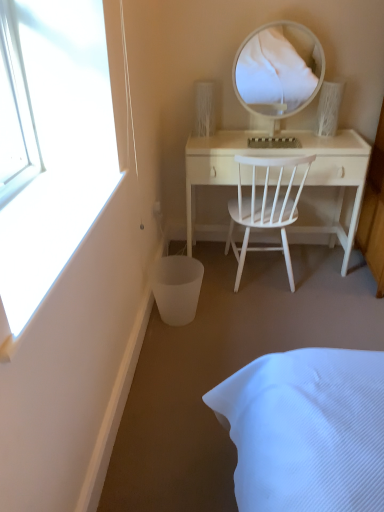
At what (x,y) coordinates should I click in order to perform the action: click on white glossy mirror at upper center. Please return your answer as a coordinate pair (x, y). This screenshot has width=384, height=512. Looking at the image, I should click on (277, 71).

You are a GUI agent. You are given a task and a screenshot of the screen. Output one action in this format:
    pyautogui.click(x=<x>, y=<y>)
    Task: Click on the white matte trash bin/can at lower left
    
    Given the screenshot: What is the action you would take?
    pyautogui.click(x=177, y=288)

Identify the location of white wood chair at center. This screenshot has width=384, height=512. (265, 209).

Locate an element on the screen. The image size is (384, 512). white wood desk at center is located at coordinates (280, 155).

Which of these two, white matte trash bin/can at lower left or white glossy mirror at upper center, is wider?

white matte trash bin/can at lower left.

Is white matte trash bin/can at lower left aimed at white glossy mirror at upper center?

No, white matte trash bin/can at lower left is not oriented towards white glossy mirror at upper center.

Considering the relative sizes of white matte trash bin/can at lower left and white glossy mirror at upper center in the image provided, is white matte trash bin/can at lower left shorter than white glossy mirror at upper center?

Correct, white matte trash bin/can at lower left is not as tall as white glossy mirror at upper center.

Do you think white matte trash bin/can at lower left is within white glossy mirror at upper center, or outside of it?

white matte trash bin/can at lower left is outside white glossy mirror at upper center.

Is white matte trash bin/can at lower left smaller than white wood chair at center?

Yes.

How many degrees apart are the facing directions of white matte trash bin/can at lower left and white wood chair at center?

The facing directions of white matte trash bin/can at lower left and white wood chair at center are 90 degrees apart.

Between point (161, 289) and point (242, 159), which one is positioned in front?

Positioned in front is point (161, 289).

From a real-world perspective, is white wood desk at center above or below white glossy mirror at upper center?

white wood desk at center is below white glossy mirror at upper center.

Measure the distance from white wood desk at center to white glossy mirror at upper center.

white wood desk at center and white glossy mirror at upper center are 1.63 meters apart.

Can you confirm if white wood desk at center is wider than white glossy mirror at upper center?

Yes, white wood desk at center is wider than white glossy mirror at upper center.

Considering the sizes of objects white wood desk at center and white glossy mirror at upper center in the image provided, who is bigger, white wood desk at center or white glossy mirror at upper center?

white wood desk at center is bigger.

Does white glossy mirror at upper center have a lesser width compared to white wood chair at center?

Yes.

Is point (286, 76) positioned after point (270, 164)?

Yes, point (286, 76) is farther from viewer.

Are white glossy mirror at upper center and white wood chair at center located far from each other?

white glossy mirror at upper center is positioned a significant distance from white wood chair at center.

Considering the sizes of white glossy mirror at upper center and white wood chair at center in the image, is white glossy mirror at upper center bigger or smaller than white wood chair at center?

In the image, white glossy mirror at upper center appears to be smaller than white wood chair at center.

Identify the location of mirror above the white wood chair at center (from the image's perspective). (277, 71).

Considering the relative sizes of white wood chair at center and white glossy mirror at upper center in the image provided, is white wood chair at center shorter than white glossy mirror at upper center?

Incorrect, the height of white wood chair at center does not fall short of that of white glossy mirror at upper center.

Is white wood chair at center not near white glossy mirror at upper center?

white wood chair at center is positioned a significant distance from white glossy mirror at upper center.

How many degrees apart are the facing directions of white wood chair at center and white glossy mirror at upper center?

The facing directions of white wood chair at center and white glossy mirror at upper center are 179 degrees apart.

From the image's perspective, is white wood chair at center on top of white matte trash bin/can at lower left?

Yes.

I want to click on chair above the white matte trash bin/can at lower left (from a real-world perspective), so [265, 209].

Are white wood chair at center and white matte trash bin/can at lower left far apart?

That's not correct — white wood chair at center is a little close to white matte trash bin/can at lower left.

Consider the image. Could you tell me if white wood desk at center is turned towards white matte trash bin/can at lower left?

Yes, white wood desk at center is aimed at white matte trash bin/can at lower left.

From their relative heights in the image, would you say white wood desk at center is taller or shorter than white matte trash bin/can at lower left?

In the image, white wood desk at center appears to be taller than white matte trash bin/can at lower left.

This screenshot has height=512, width=384. What are the coordinates of `mirror located on the right of white matte trash bin/can at lower left` in the screenshot? It's located at (277, 71).

This screenshot has width=384, height=512. Identify the location of chair that appears above the white matte trash bin/can at lower left (from the image's perspective). (265, 209).

From the image, which object appears to be farther from white matte trash bin/can at lower left, white glossy mirror at upper center or white wood chair at center?

white glossy mirror at upper center is positioned further to the anchor white matte trash bin/can at lower left.

Looking at the image, which one is located closer to white glossy mirror at upper center, white wood desk at center or white wood chair at center?

The object closer to white glossy mirror at upper center is white wood desk at center.

Based on their spatial positions, is white matte trash bin/can at lower left or white glossy mirror at upper center further from white wood desk at center?

white glossy mirror at upper center is positioned further to the anchor white wood desk at center.

When comparing their distances from white glossy mirror at upper center, does white wood chair at center or white wood desk at center seem further?

white wood chair at center.

Based on their spatial positions, is white wood desk at center or white glossy mirror at upper center further from white wood chair at center?

A: white glossy mirror at upper center is further to white wood chair at center.

Estimate the real-world distances between objects in this image. Which object is further from white glossy mirror at upper center, white wood desk at center or white matte trash bin/can at lower left?

white matte trash bin/can at lower left.

Estimate the real-world distances between objects in this image. Which object is further from white glossy mirror at upper center, white wood chair at center or white matte trash bin/can at lower left?

white matte trash bin/can at lower left is further to white glossy mirror at upper center.

Looking at the image, which one is located further to white wood chair at center, white glossy mirror at upper center or white wood desk at center?

white glossy mirror at upper center is further to white wood chair at center.

Identify the location of desk between white glossy mirror at upper center and white wood chair at center from top to bottom. (x=280, y=155).

Find the location of `chair between white glossy mirror at upper center and white matte trash bin/can at lower left in the up-down direction`. chair between white glossy mirror at upper center and white matte trash bin/can at lower left in the up-down direction is located at coordinates (265, 209).

You are a GUI agent. You are given a task and a screenshot of the screen. Output one action in this format:
    pyautogui.click(x=<x>, y=<y>)
    Task: Click on the desk between white glossy mirror at upper center and white matte trash bin/can at lower left vertically
    
    Given the screenshot: What is the action you would take?
    pyautogui.click(x=280, y=155)

I want to click on chair between white matte trash bin/can at lower left and white wood desk at center in the horizontal direction, so click(265, 209).